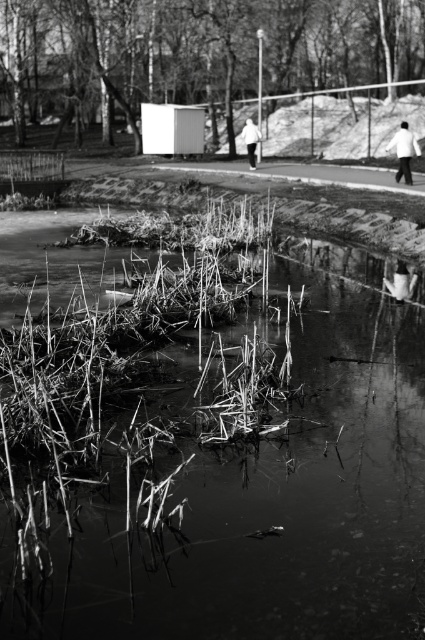
You are standing at the center of the paved path in the midground. You see the white matte jacket at upper right and the white fabric shoe at lower right. Which object is positioned more to your right side?

The white matte jacket at upper right is positioned more to the right side than the white fabric shoe at lower right.

From the picture: You are a photographer trying to capture the reeds at lower center and the white matte jacket at center in the same frame. Which object is wider in the image?

The reeds at lower center are wider than the white matte jacket at center in the image.